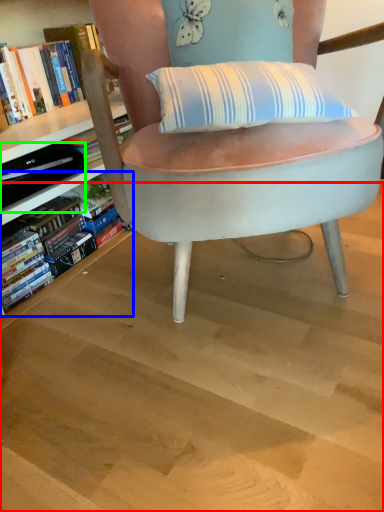
Question: Considering the real-world distances, which object is farthest from stairwell (highlighted by a red box)? book (highlighted by a blue box) or paperback book (highlighted by a green box)?

Choices:
 (A) book
 (B) paperback book

Answer: (B)